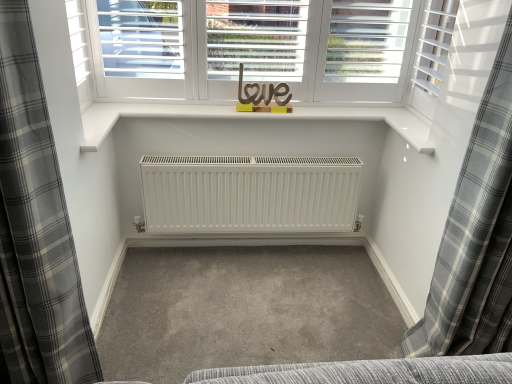
I want to click on gray plaid curtain at left, positioned as the 2th curtain in right-to-left order, so click(x=35, y=229).

You are a GUI agent. You are given a task and a screenshot of the screen. Output one action in this format:
    pyautogui.click(x=<x>, y=<y>)
    Task: Click on the gray plaid curtain at right, placed as the second curtain when sorted from left to right
    The image size is (512, 384).
    Given the screenshot: What is the action you would take?
    pyautogui.click(x=476, y=237)

I want to click on gray plaid curtain at left, positioned as the 2th curtain in right-to-left order, so click(35, 229).

In the scene shown: How far apart are gray plaid curtain at left, positioned as the 2th curtain in right-to-left order, and white matte shutter at upper right?

They are 5.43 feet apart.

From the image's perspective, is gray plaid curtain at left, acting as the first curtain starting from the left, located above white matte shutter at upper right?

Actually, gray plaid curtain at left, acting as the first curtain starting from the left, appears below white matte shutter at upper right in the image.

Considering the sizes of gray plaid curtain at left, positioned as the 2th curtain in right-to-left order, and white matte shutter at upper right in the image, is gray plaid curtain at left, positioned as the 2th curtain in right-to-left order, taller or shorter than white matte shutter at upper right?

gray plaid curtain at left, positioned as the 2th curtain in right-to-left order, is taller than white matte shutter at upper right.

Is gray plaid curtain at left, acting as the first curtain starting from the left, not close to white matte shutter at upper right?

gray plaid curtain at left, acting as the first curtain starting from the left, is positioned a significant distance from white matte shutter at upper right.

Where is `curtain located above the gray plaid curtain at left, acting as the first curtain starting from the left (from a real-world perspective)`? Image resolution: width=512 pixels, height=384 pixels. curtain located above the gray plaid curtain at left, acting as the first curtain starting from the left (from a real-world perspective) is located at coordinates click(x=476, y=237).

Could gray plaid curtain at right, placed as the second curtain when sorted from left to right, be considered to be inside gray plaid curtain at left, positioned as the 2th curtain in right-to-left order?

No, gray plaid curtain at right, placed as the second curtain when sorted from left to right, is located outside of gray plaid curtain at left, positioned as the 2th curtain in right-to-left order.

Looking at the image, does gray plaid curtain at left, positioned as the 2th curtain in right-to-left order, seem bigger or smaller compared to gray plaid curtain at right, placed as the second curtain when sorted from left to right?

Clearly, gray plaid curtain at left, positioned as the 2th curtain in right-to-left order, is larger in size than gray plaid curtain at right, placed as the second curtain when sorted from left to right.

Relative to gray plaid curtain at left, positioned as the 2th curtain in right-to-left order, is gray plaid curtain at right, placed as the second curtain when sorted from left to right, in front or behind?

Visually, gray plaid curtain at right, placed as the second curtain when sorted from left to right, is located behind gray plaid curtain at left, positioned as the 2th curtain in right-to-left order.

From a real-world perspective, is gray plaid curtain at right, placed as the second curtain when sorted from left to right, positioned above or below gray plaid curtain at left, positioned as the 2th curtain in right-to-left order?

Clearly, from a real-world perspective, gray plaid curtain at right, placed as the second curtain when sorted from left to right, is above gray plaid curtain at left, positioned as the 2th curtain in right-to-left order.

In the image, is white matte shutter at upper right positioned in front of or behind gray plaid curtain at right, placed as the second curtain when sorted from left to right?

Visually, white matte shutter at upper right is located behind gray plaid curtain at right, placed as the second curtain when sorted from left to right.

Could you tell me if white matte shutter at upper right is turned towards gray plaid curtain at right, placed as the second curtain when sorted from left to right?

No, white matte shutter at upper right is not turned towards gray plaid curtain at right, placed as the second curtain when sorted from left to right.

Looking at this image, from a real-world perspective, is white matte shutter at upper right over gray plaid curtain at right, placed as the second curtain when sorted from left to right?

Indeed, from a real-world perspective, white matte shutter at upper right stands above gray plaid curtain at right, placed as the second curtain when sorted from left to right.

Which of these two, white matte shutter at upper right or gray plaid curtain at right, which ranks as the first curtain in right-to-left order, is bigger?

gray plaid curtain at right, which ranks as the first curtain in right-to-left order.

From the image's perspective, is gray plaid curtain at right, which ranks as the first curtain in right-to-left order, located beneath white matte shutter at upper right?

Yes, from the image's perspective, gray plaid curtain at right, which ranks as the first curtain in right-to-left order, is beneath white matte shutter at upper right.

Is white matte shutter at upper right located within gray plaid curtain at right, which ranks as the first curtain in right-to-left order?

That's incorrect, white matte shutter at upper right is not inside gray plaid curtain at right, which ranks as the first curtain in right-to-left order.

Can you confirm if gray plaid curtain at right, which ranks as the first curtain in right-to-left order, is shorter than white matte shutter at upper right?

In fact, gray plaid curtain at right, which ranks as the first curtain in right-to-left order, may be taller than white matte shutter at upper right.

Is white matte shutter at upper right to the right of gray plaid curtain at left, acting as the first curtain starting from the left, from the viewer's perspective?

Correct, you'll find white matte shutter at upper right to the right of gray plaid curtain at left, acting as the first curtain starting from the left.

Between white matte shutter at upper right and gray plaid curtain at left, positioned as the 2th curtain in right-to-left order, which one has larger width?

gray plaid curtain at left, positioned as the 2th curtain in right-to-left order.

From their relative heights in the image, would you say white matte shutter at upper right is taller or shorter than gray plaid curtain at left, positioned as the 2th curtain in right-to-left order?

Clearly, white matte shutter at upper right is shorter compared to gray plaid curtain at left, positioned as the 2th curtain in right-to-left order.

Is white matte shutter at upper right next to gray plaid curtain at left, acting as the first curtain starting from the left?

There is a gap between white matte shutter at upper right and gray plaid curtain at left, acting as the first curtain starting from the left.

You are a GUI agent. You are given a task and a screenshot of the screen. Output one action in this format:
    pyautogui.click(x=<x>, y=<y>)
    Task: Click on the 2nd curtain positioned below the white matte shutter at upper right (from the image's perspective)
    
    Given the screenshot: What is the action you would take?
    pyautogui.click(x=35, y=229)

Find the location of a particular element. The image size is (512, 384). curtain on the right side of gray plaid curtain at left, acting as the first curtain starting from the left is located at coordinates (476, 237).

Considering their positions, is gray plaid curtain at right, which ranks as the first curtain in right-to-left order, positioned closer to white matte shutter at upper right than gray plaid curtain at left, acting as the first curtain starting from the left?

Based on the image, gray plaid curtain at right, which ranks as the first curtain in right-to-left order, appears to be nearer to white matte shutter at upper right.

Estimate the real-world distances between objects in this image. Which object is further from gray plaid curtain at right, placed as the second curtain when sorted from left to right, white matte shutter at upper right or gray plaid curtain at left, positioned as the 2th curtain in right-to-left order?

gray plaid curtain at left, positioned as the 2th curtain in right-to-left order, is further to gray plaid curtain at right, placed as the second curtain when sorted from left to right.

From the image, which object appears to be nearer to gray plaid curtain at left, positioned as the 2th curtain in right-to-left order, gray plaid curtain at right, which ranks as the first curtain in right-to-left order, or white matte shutter at upper right?

Among the two, gray plaid curtain at right, which ranks as the first curtain in right-to-left order, is located nearer to gray plaid curtain at left, positioned as the 2th curtain in right-to-left order.

Based on their spatial positions, is gray plaid curtain at left, positioned as the 2th curtain in right-to-left order, or white matte shutter at upper right further from gray plaid curtain at right, placed as the second curtain when sorted from left to right?

gray plaid curtain at left, positioned as the 2th curtain in right-to-left order, is further to gray plaid curtain at right, placed as the second curtain when sorted from left to right.

When comparing their distances from white matte shutter at upper right, does gray plaid curtain at left, positioned as the 2th curtain in right-to-left order, or gray plaid curtain at right, which ranks as the first curtain in right-to-left order, seem further?

gray plaid curtain at left, positioned as the 2th curtain in right-to-left order, is positioned further to the anchor white matte shutter at upper right.

Based on the photo, when comparing their distances from gray plaid curtain at left, acting as the first curtain starting from the left, does white matte shutter at upper right or gray plaid curtain at right, which ranks as the first curtain in right-to-left order, seem closer?

The object closer to gray plaid curtain at left, acting as the first curtain starting from the left, is gray plaid curtain at right, which ranks as the first curtain in right-to-left order.

Find the location of a particular element. shutter located between gray plaid curtain at left, positioned as the 2th curtain in right-to-left order, and gray plaid curtain at right, placed as the second curtain when sorted from left to right, in the left-right direction is located at coordinates (431, 55).